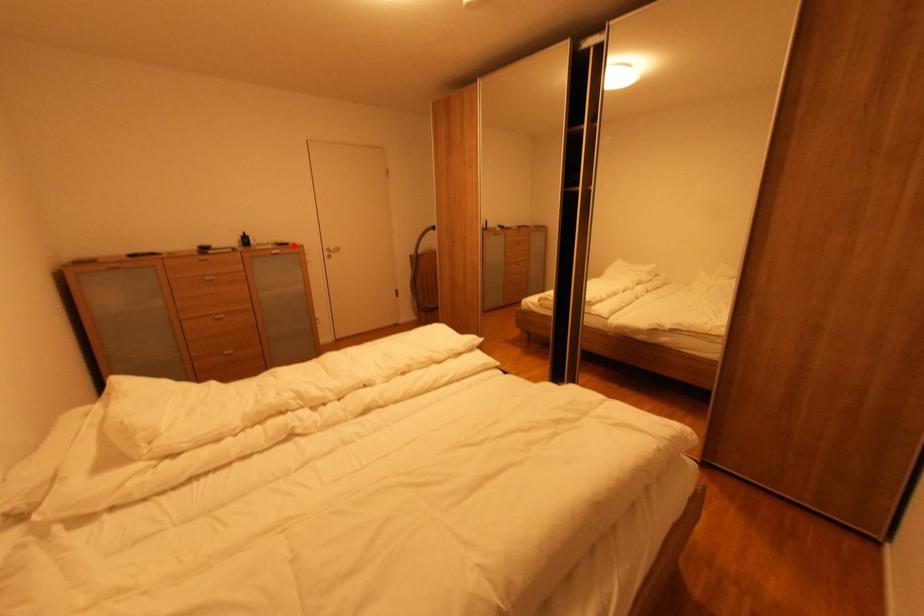
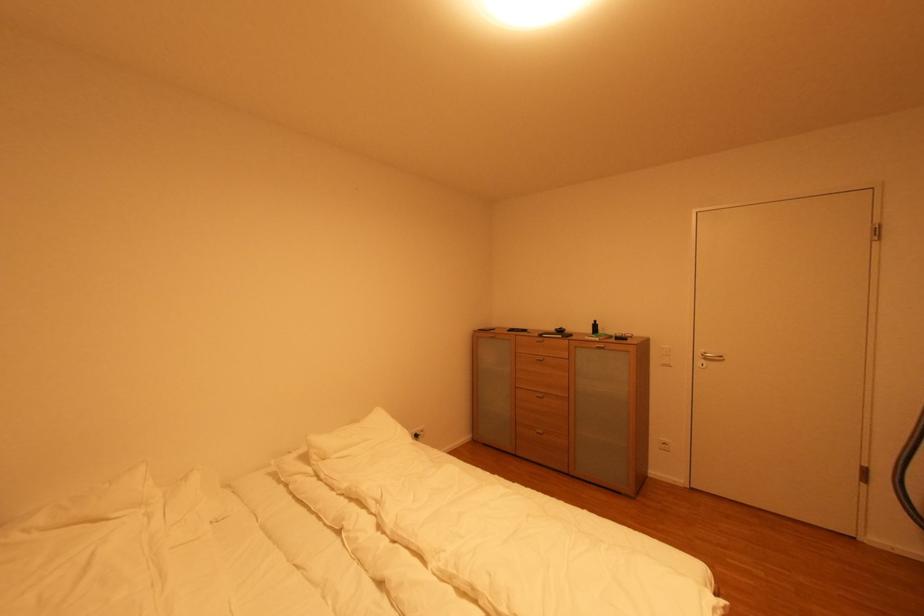
Question: I am providing you with two images of the same scene from different viewpoints. Given a red point in image1, look at the same physical point in image2. Is it:

Choices:
 (A) Closer to the viewpoint
 (B) Farther from the viewpoint

Answer: (B)